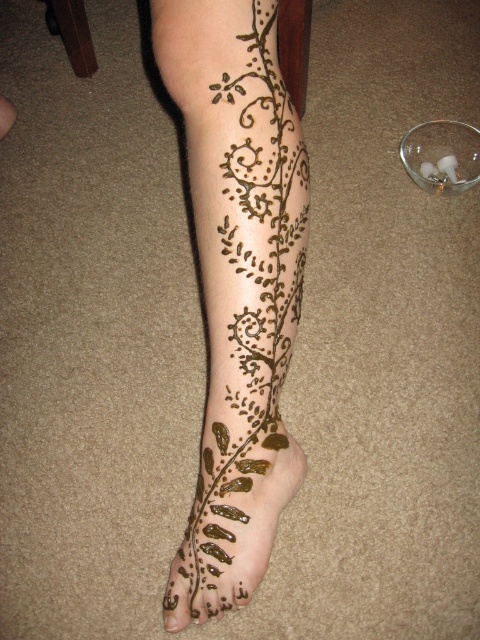
What are the coordinates of the brown henna tattoo at lower center?

The brown henna tattoo at lower center is located at coordinates point (237, 285).

You are taking a photo of the intricate henna designs on the leg and notice two points marked as point (x=276, y=524) and point (x=262, y=490). Which point is closer to the camera?

Point (x=276, y=524) is further to the camera than point (x=262, y=490). Therefore, point (x=262, y=490) is closer to the camera.